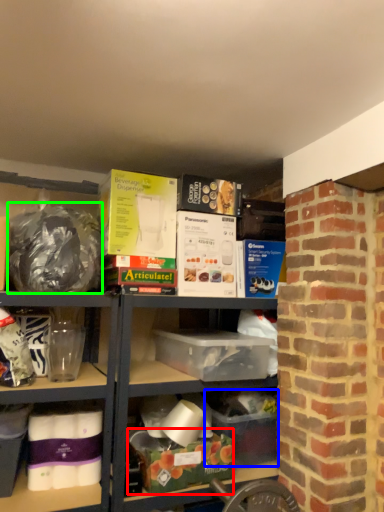
Question: Estimate the real-world distances between objects in this image. Which object is farther from box (highlighted by a red box), box (highlighted by a blue box) or waste (highlighted by a green box)?

Choices:
 (A) box
 (B) waste

Answer: (B)